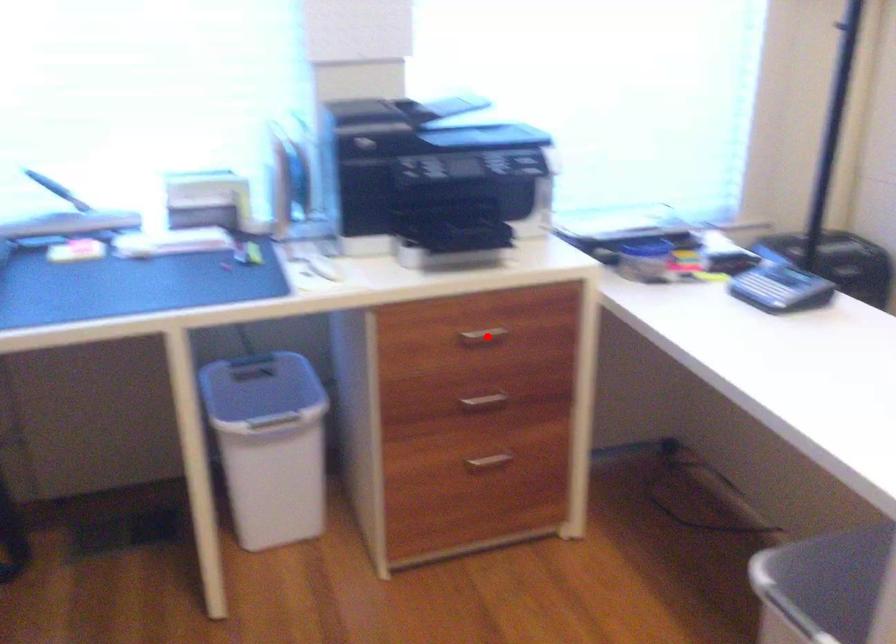
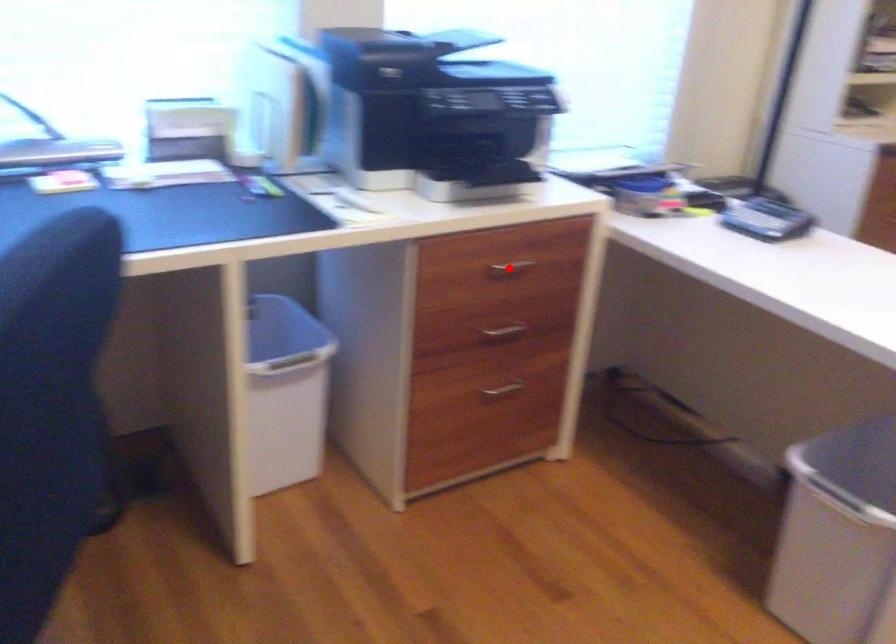
I am providing you with two images of the same scene from different viewpoints. A red point is marked on the first image and another point is marked on the second image. Do the highlighted points in image1 and image2 indicate the same real-world spot?

Yes